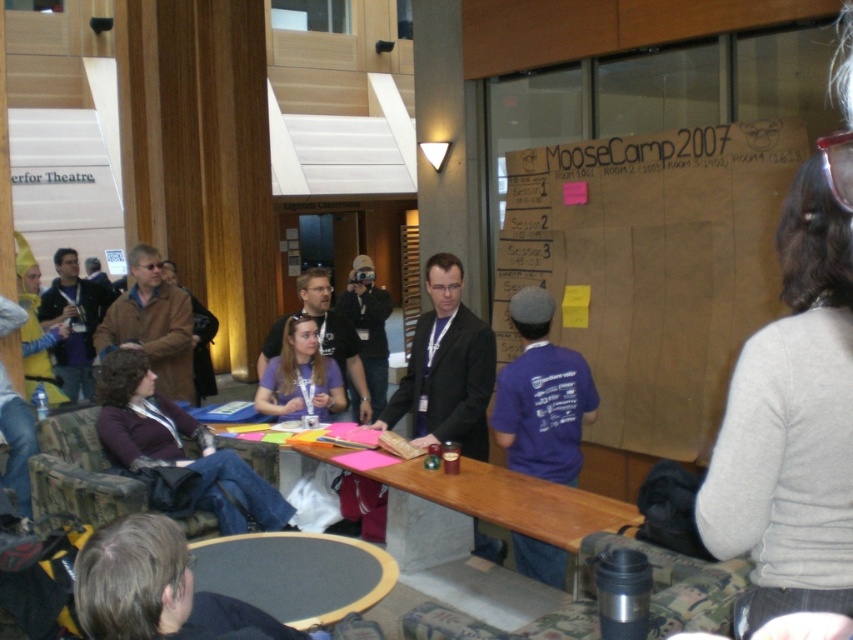
Question: Which object is closer to the camera taking this photo?

Choices:
 (A) matte black jacket at left
 (B) brown leather jacket at center

Answer: (B)

Question: Based on their relative distances, which object is farther from the matte black jacket at left?

Choices:
 (A) matte black camera at center
 (B) black felt table at lower center

Answer: (B)

Question: Does purple cotton shirt at center appear under matte black jacket at left?

Choices:
 (A) yes
 (B) no

Answer: (A)

Question: Is wooden table at center further to the viewer compared to black suit at center?

Choices:
 (A) no
 (B) yes

Answer: (A)

Question: In this image, where is black suit at center located relative to matte black camera at center?

Choices:
 (A) above
 (B) below

Answer: (B)

Question: Which object appears closest to the camera in this image?

Choices:
 (A) purple cotton shirt at center
 (B) matte black jacket at left
 (C) black suit at center
 (D) matte black camera at center

Answer: (A)